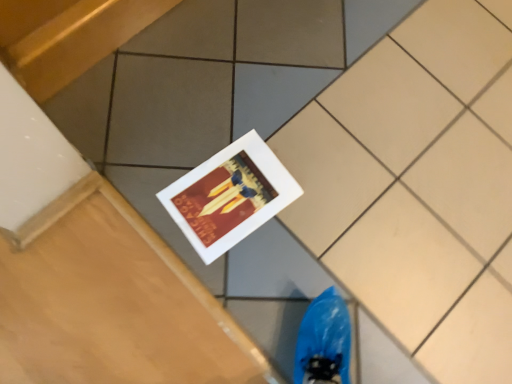
Find the location of `empty space that is ontop of white matte picture frame at center (from a real-world perspective)`. empty space that is ontop of white matte picture frame at center (from a real-world perspective) is located at coordinates (237, 193).